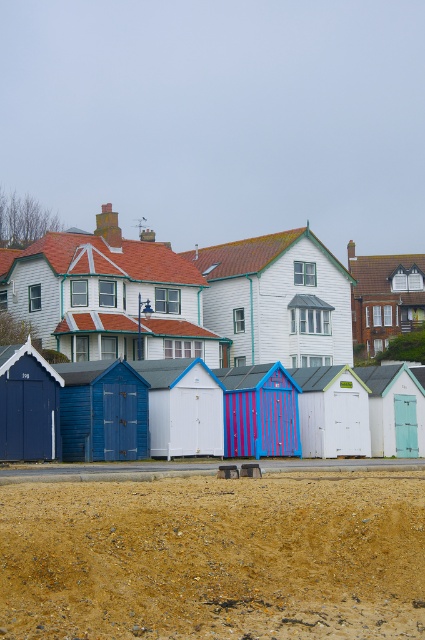
Where is `brown sandy dirt at lower center`? The image size is (425, 640). brown sandy dirt at lower center is located at coordinates (214, 557).

In the scene shown: Is brown sandy dirt at lower center bigger than white painted wood beach hut at center?

Incorrect, brown sandy dirt at lower center is not larger than white painted wood beach hut at center.

Between brown sandy dirt at lower center and white painted wood beach hut at center, which one has more height?

white painted wood beach hut at center

This screenshot has height=640, width=425. I want to click on brown sandy dirt at lower center, so click(x=214, y=557).

Who is taller, brown sandy dirt at lower center or white wood beach hut at center?

With more height is white wood beach hut at center.

Can you confirm if brown sandy dirt at lower center is positioned to the right of white wood beach hut at center?

No, brown sandy dirt at lower center is not to the right of white wood beach hut at center.

What do you see at coordinates (214, 557) in the screenshot?
I see `brown sandy dirt at lower center` at bounding box center [214, 557].

Locate an element on the screen. The height and width of the screenshot is (640, 425). brown sandy dirt at lower center is located at coordinates (214, 557).